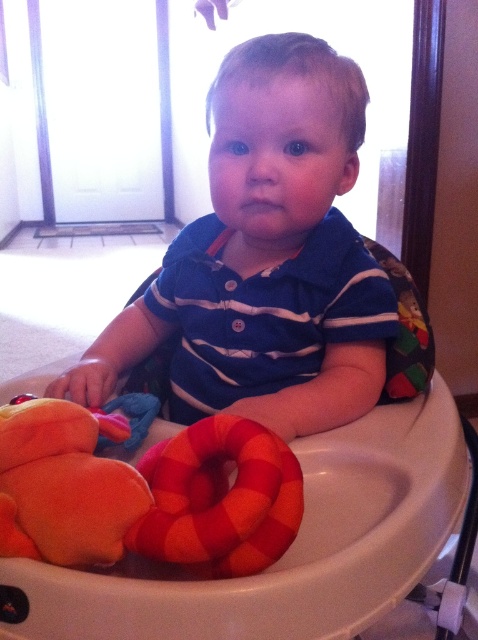
You are a parent trying to clean up the baby area. You need to put away the plush fabric ring at lower center and the soft plush toy at lower left. Which toy should you place to the right side of the storage bin first?

You should place the plush fabric ring at lower center to the right side of the storage bin first because it is already positioned to the right of the soft plush toy at lower left in the image.